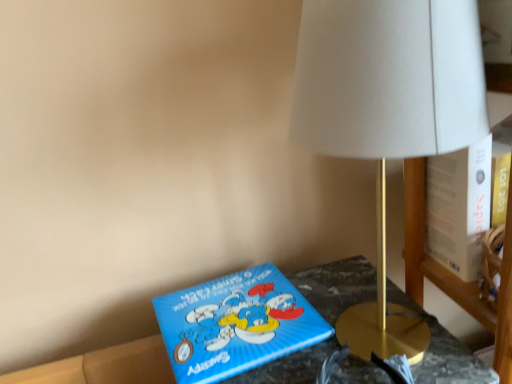
Locate an element on the screen. The width and height of the screenshot is (512, 384). free point to the right of blue matte puzzle box at lower center is located at coordinates (358, 313).